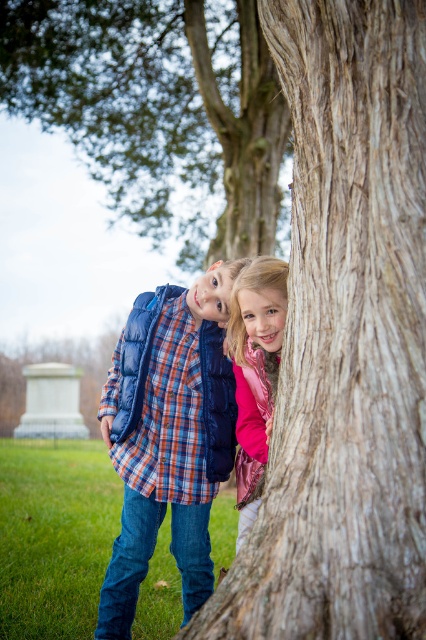
Does rough bark tree at upper center have a smaller size compared to blue down jacket at center?

No, rough bark tree at upper center is not smaller than blue down jacket at center.

Is rough bark tree at upper center above blue down jacket at center?

Yes.

Does point (28, 4) come behind point (201, 604)?

Yes, it is.

The image size is (426, 640). In order to click on rough bark tree at upper center in this screenshot , I will do 155,104.

Is the position of smooth brown bark at center more distant than that of rough bark tree at upper center?

No, it is in front of rough bark tree at upper center.

Who is positioned more to the left, smooth brown bark at center or rough bark tree at upper center?

rough bark tree at upper center

Who is more distant from viewer, (417, 276) or (169, 124)?

Positioned behind is point (169, 124).

Locate an element on the screen. This screenshot has width=426, height=640. smooth brown bark at center is located at coordinates (345, 340).

The width and height of the screenshot is (426, 640). What do you see at coordinates (167, 436) in the screenshot?
I see `blue down jacket at center` at bounding box center [167, 436].

Does blue down jacket at center come behind pink metallic jacket at center?

Yes.

Is point (215, 406) less distant than point (244, 440)?

No, (215, 406) is further to viewer.

The image size is (426, 640). I want to click on blue down jacket at center, so click(167, 436).